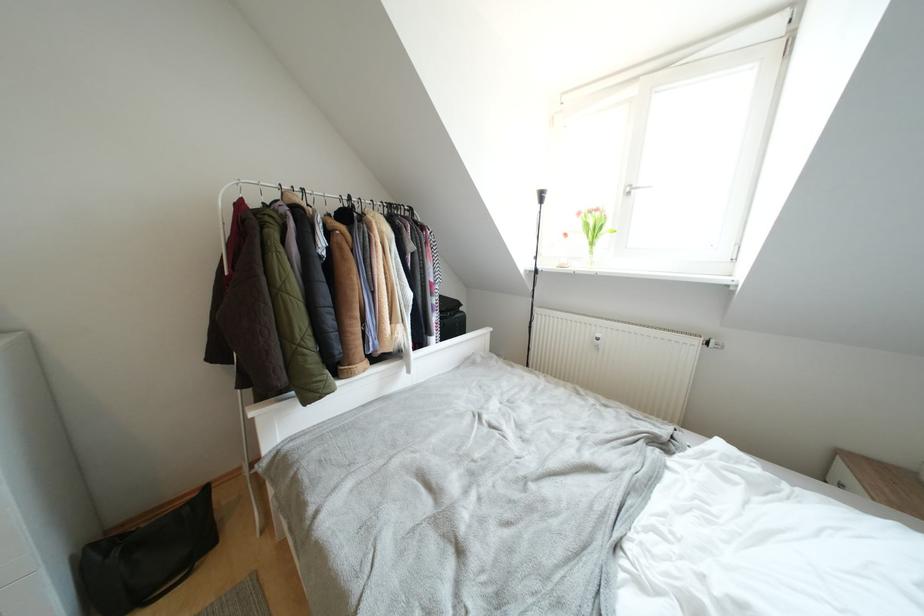
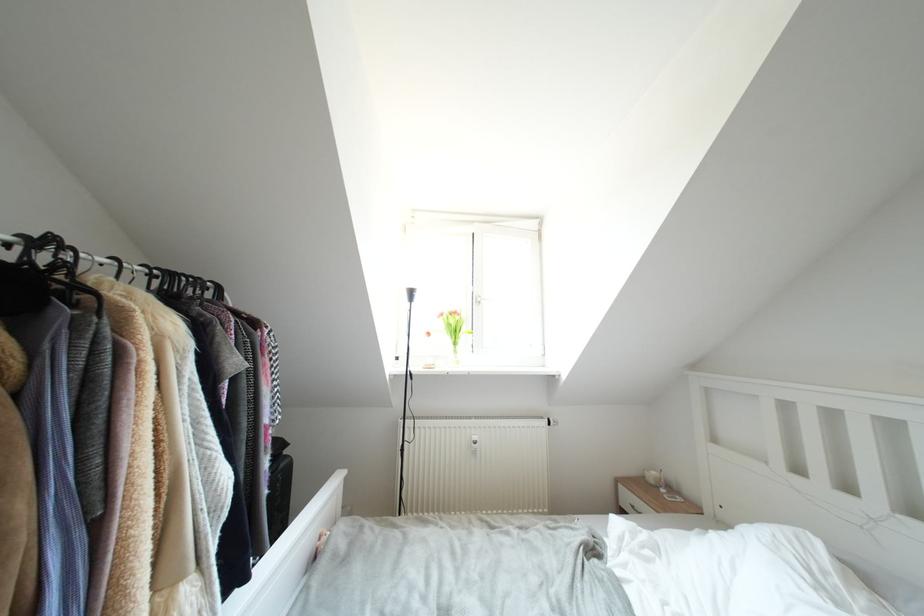
The first image is from the beginning of the video and the second image is from the end. How did the camera likely rotate when shooting the video?

The rotation direction of the camera is right-up.